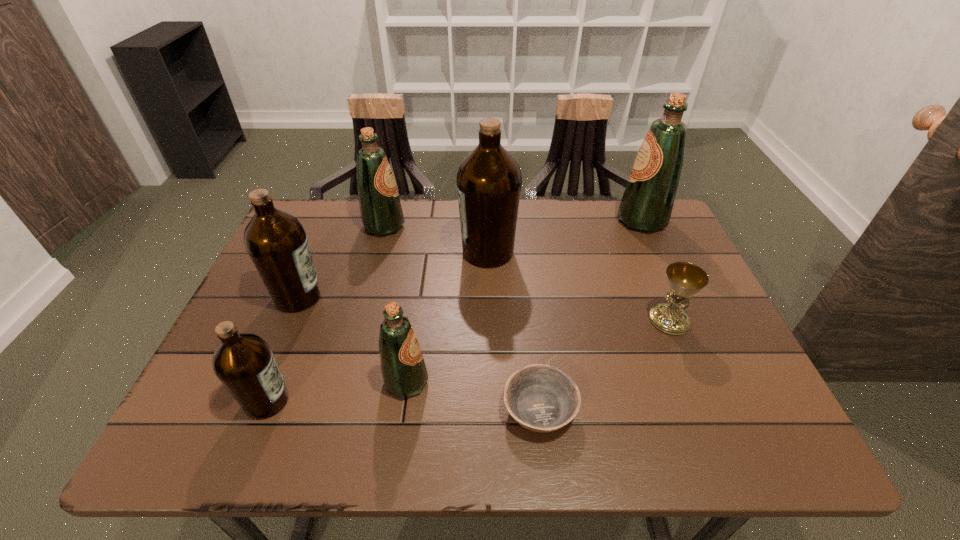
I want to click on free point that satisfies the following two spatial constraints: 1. on the front-facing side of the rightmost olive oil; 2. on the front side of the seventh tallest object, so click(687, 320).